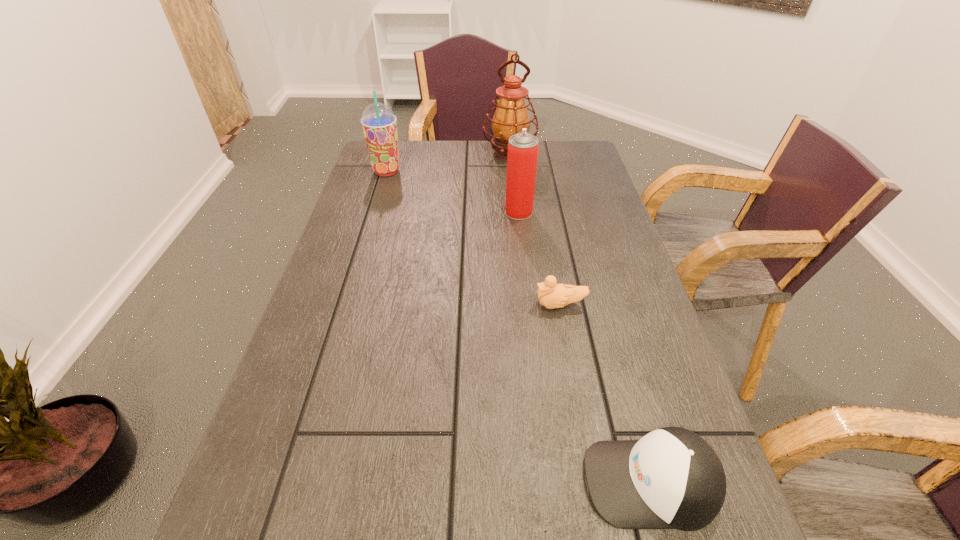
At what (x,y) coordinates should I click in order to perform the action: click on free region located 0.150m on the front panel of the cap. Please return your answer as a coordinate pair (x, y). Image resolution: width=960 pixels, height=540 pixels. Looking at the image, I should click on (491, 482).

Locate an element on the screen. This screenshot has width=960, height=540. blank space located on the front panel of the cap is located at coordinates (403, 482).

Where is `vacant space located 0.230m on the front panel of the cap`? vacant space located 0.230m on the front panel of the cap is located at coordinates (441, 482).

Find the location of a particular element. The height and width of the screenshot is (540, 960). free location located on the face of the duckling is located at coordinates (419, 305).

The width and height of the screenshot is (960, 540). What are the coordinates of `free location located on the face of the duckling` in the screenshot? It's located at (383, 305).

Locate an element on the screen. This screenshot has width=960, height=540. blank space located 0.170m on the face of the duckling is located at coordinates (459, 305).

The width and height of the screenshot is (960, 540). What are the coordinates of `oil lamp present at the far edge` in the screenshot? It's located at (511, 115).

This screenshot has height=540, width=960. I want to click on smoothie that is at the far edge, so click(x=379, y=123).

In order to click on object that is at the left edge in this screenshot , I will do `click(379, 123)`.

The image size is (960, 540). Find the location of `cap that is at the right edge`. cap that is at the right edge is located at coordinates (671, 478).